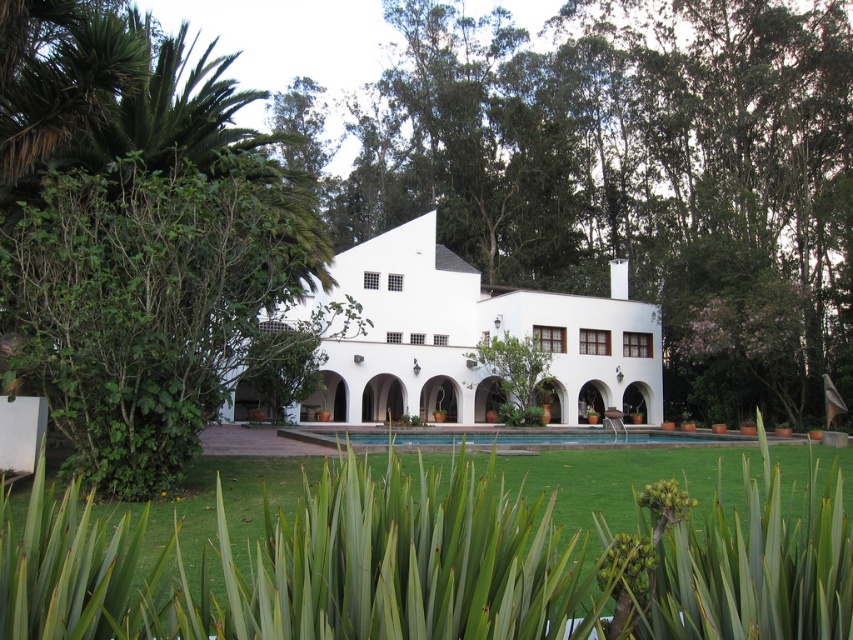
This screenshot has height=640, width=853. What do you see at coordinates (434, 564) in the screenshot?
I see `green grass at center` at bounding box center [434, 564].

What do you see at coordinates (434, 564) in the screenshot?
I see `green grass at center` at bounding box center [434, 564].

Locate an element on the screen. This screenshot has width=853, height=640. green grass at center is located at coordinates (434, 564).

Is point (718, 355) in front of point (439, 304)?

Yes, it is in front of point (439, 304).

Between point (453, 93) and point (433, 275), which one is positioned in front?

Point (433, 275) is more forward.

You are a GUI agent. You are given a task and a screenshot of the screen. Output one action in this format:
    pyautogui.click(x=<x>, y=<y>)
    Task: Click on the green leafy tree at center
    The image size is (853, 640).
    Given the screenshot: What is the action you would take?
    coord(630,173)

Where is `green leafy tree at center`? green leafy tree at center is located at coordinates (630, 173).

Can you confirm if green leafy tree at center is bigger than green leafy tree at left?

Indeed, green leafy tree at center has a larger size compared to green leafy tree at left.

Can you confirm if green leafy tree at center is wider than green leafy tree at left?

Indeed, green leafy tree at center has a greater width compared to green leafy tree at left.

Locate an element on the screen. This screenshot has width=853, height=640. green leafy tree at center is located at coordinates (630, 173).

This screenshot has width=853, height=640. What are the coordinates of `green leafy tree at center` in the screenshot? It's located at (630, 173).